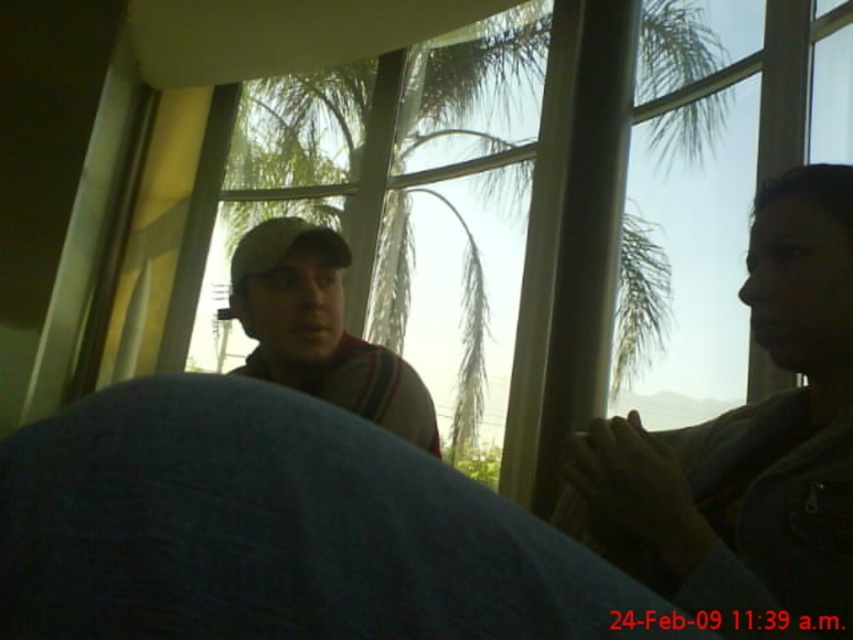
Question: Which point is farther from the camera taking this photo?

Choices:
 (A) (424, 394)
 (B) (633, 552)

Answer: (A)

Question: Is the position of denim jacket at right less distant than that of matte beige cap at center?

Choices:
 (A) yes
 (B) no

Answer: (A)

Question: Is denim jacket at right behind matte beige cap at center?

Choices:
 (A) yes
 (B) no

Answer: (B)

Question: Can you confirm if denim jacket at right is positioned above matte beige cap at center?

Choices:
 (A) yes
 (B) no

Answer: (A)